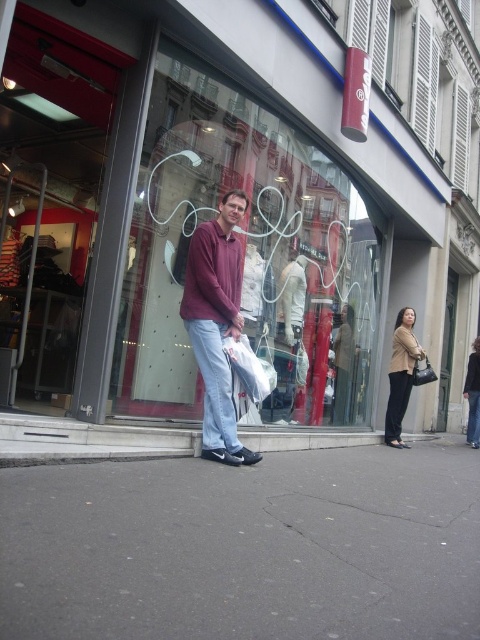
Between transparent glass shop window at center and matte maroon shirt at center, which one appears on the right side from the viewer's perspective?

transparent glass shop window at center is more to the right.

Is transparent glass shop window at center closer to the viewer compared to matte maroon shirt at center?

Yes, it is.

Which is behind, point (327, 340) or point (217, 321)?

The point (327, 340) is behind.

You are a GUI agent. You are given a task and a screenshot of the screen. Output one action in this format:
    pyautogui.click(x=<x>, y=<y>)
    Task: Click on the transparent glass shop window at center
    The width and height of the screenshot is (480, 640).
    Given the screenshot: What is the action you would take?
    pyautogui.click(x=248, y=257)

Does gray asphalt at center appear on the right side of matte maroon shirt at center?

Yes, gray asphalt at center is to the right of matte maroon shirt at center.

Between gray asphalt at center and matte maroon shirt at center, which one is positioned higher?

matte maroon shirt at center is higher up.

Is point (328, 484) positioned after point (223, 394)?

No, (328, 484) is in front of (223, 394).

What are the coordinates of `gray asphalt at center` in the screenshot? It's located at (244, 547).

Does transparent glass shop window at center appear under white plastic shopping bag at center?

No, transparent glass shop window at center is not below white plastic shopping bag at center.

Which of these two, transparent glass shop window at center or white plastic shopping bag at center, stands shorter?

white plastic shopping bag at center is shorter.

Does point (168, 237) come closer to viewer compared to point (235, 406)?

No, (168, 237) is further to viewer.

Where is `transparent glass shop window at center`? The height and width of the screenshot is (640, 480). transparent glass shop window at center is located at coordinates (248, 257).